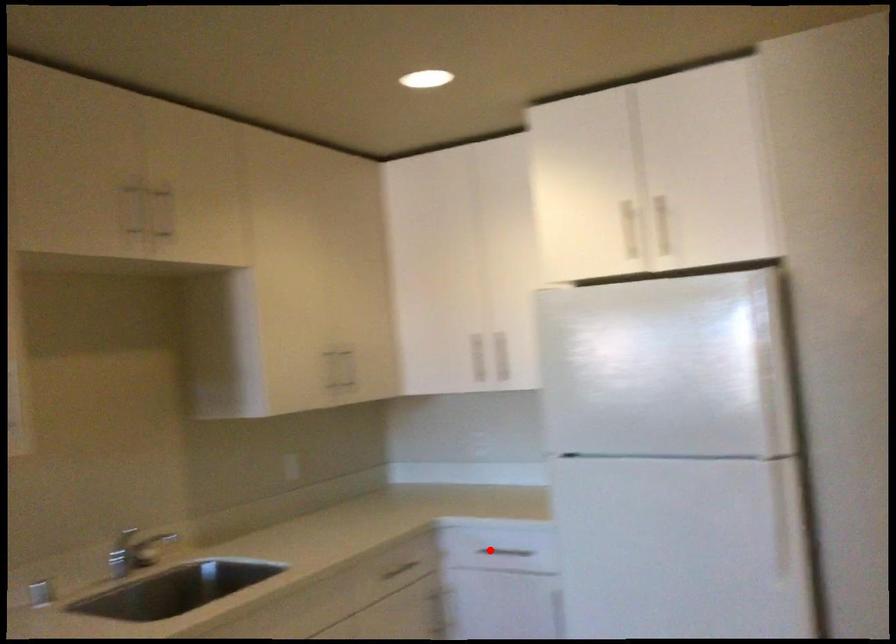
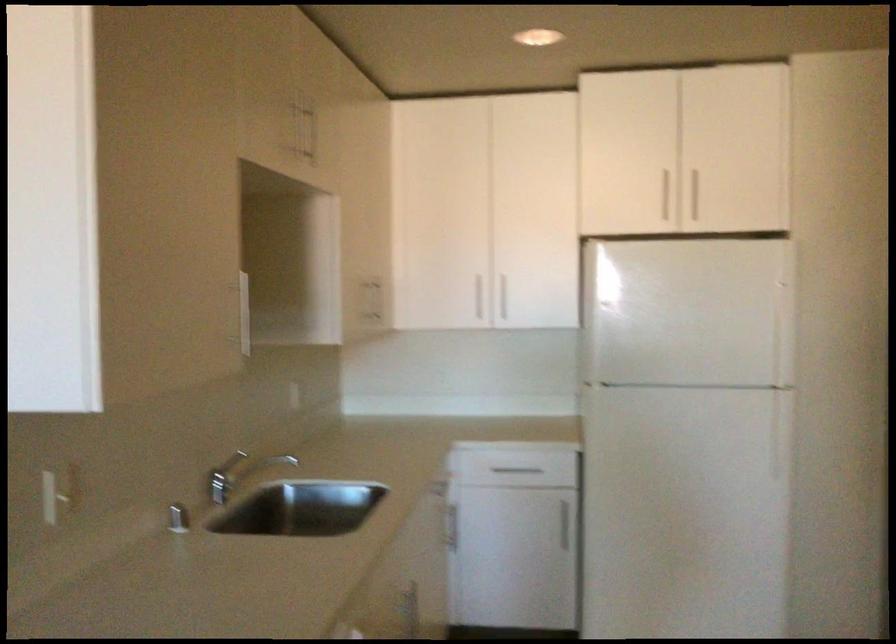
The point at the highlighted location is marked in the first image. Where is the corresponding point in the second image?

(513, 469)